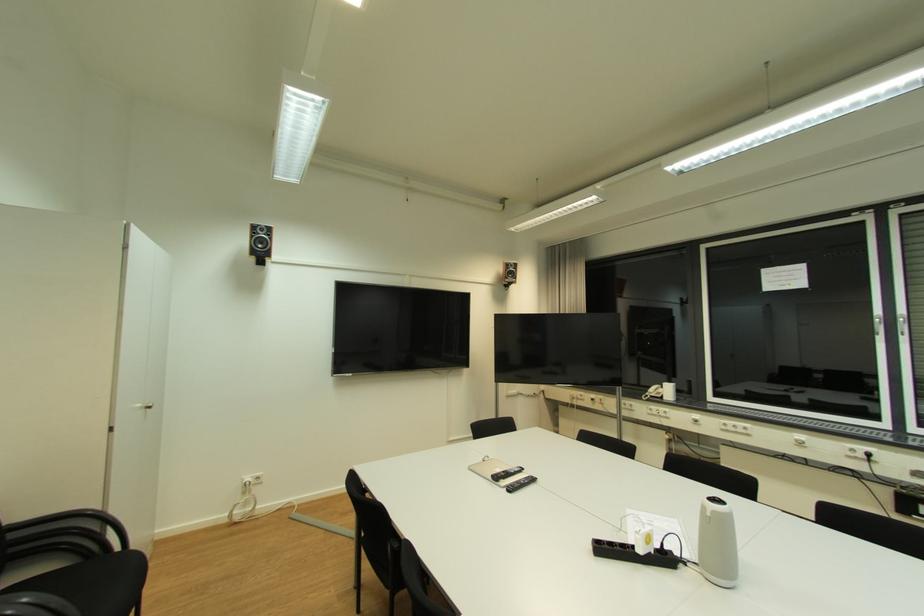
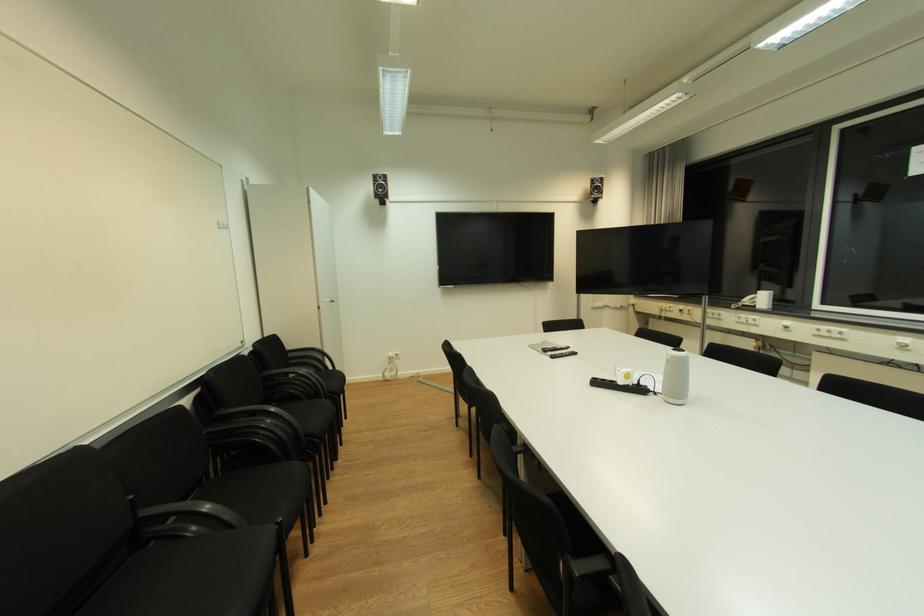
Find the pixel in the second image that matches point 146,407 in the first image.

(334, 301)